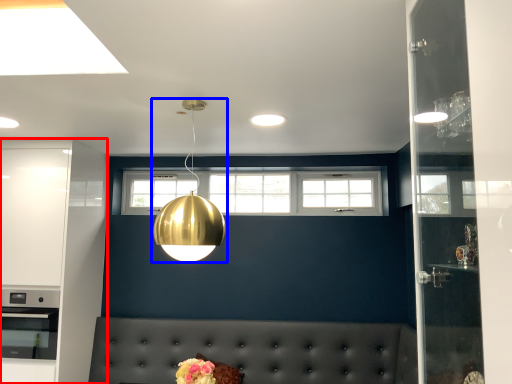
Question: Among these objects, which one is nearest to the camera, cabinetry (highlighted by a red box) or lamp (highlighted by a blue box)?

Choices:
 (A) cabinetry
 (B) lamp

Answer: (B)